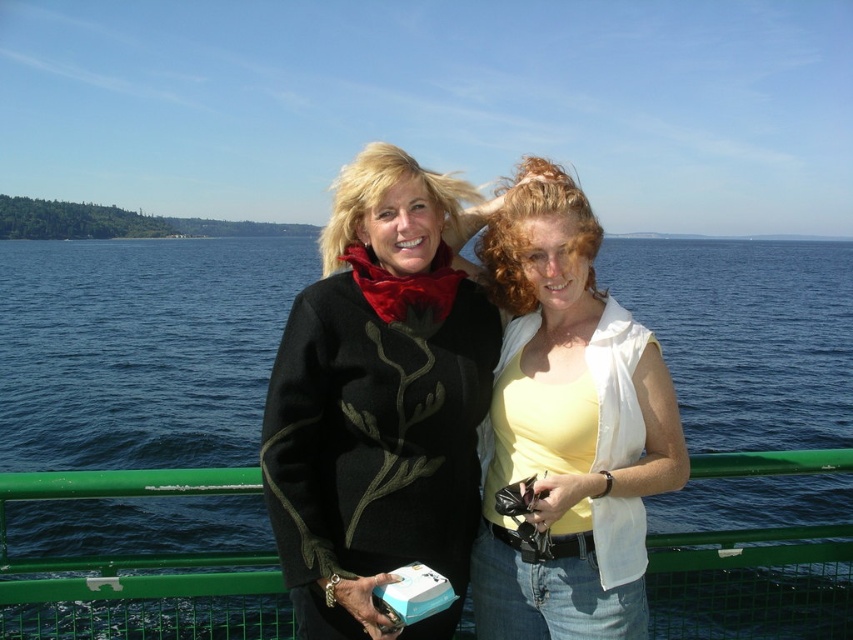
Can you confirm if blue water at center is taller than green metal railing at center?

Yes.

Is point (51, 294) positioned after point (270, 595)?

Yes, point (51, 294) is behind point (270, 595).

Between point (90, 598) and point (744, 609), which one is positioned in front?

Point (90, 598)

Where is `blue water at center`? The width and height of the screenshot is (853, 640). blue water at center is located at coordinates (140, 385).

Does blue water at center come in front of yellow matte tank top at center?

Yes.

The width and height of the screenshot is (853, 640). What do you see at coordinates (140, 385) in the screenshot? I see `blue water at center` at bounding box center [140, 385].

Which is behind, point (49, 365) or point (560, 593)?

Positioned behind is point (49, 365).

Find the location of `blue water at center`. blue water at center is located at coordinates (140, 385).

Looking at this image, can you confirm if black woolen sweater at center is bigger than green metal railing at center?

No, black woolen sweater at center is not bigger than green metal railing at center.

Is point (325, 563) less distant than point (764, 460)?

Yes.

Measure the distance between point (439, 280) and camera.

A distance of 11.40 meters exists between point (439, 280) and camera.

In order to click on black woolen sweater at center in this screenshot , I will do `click(379, 401)`.